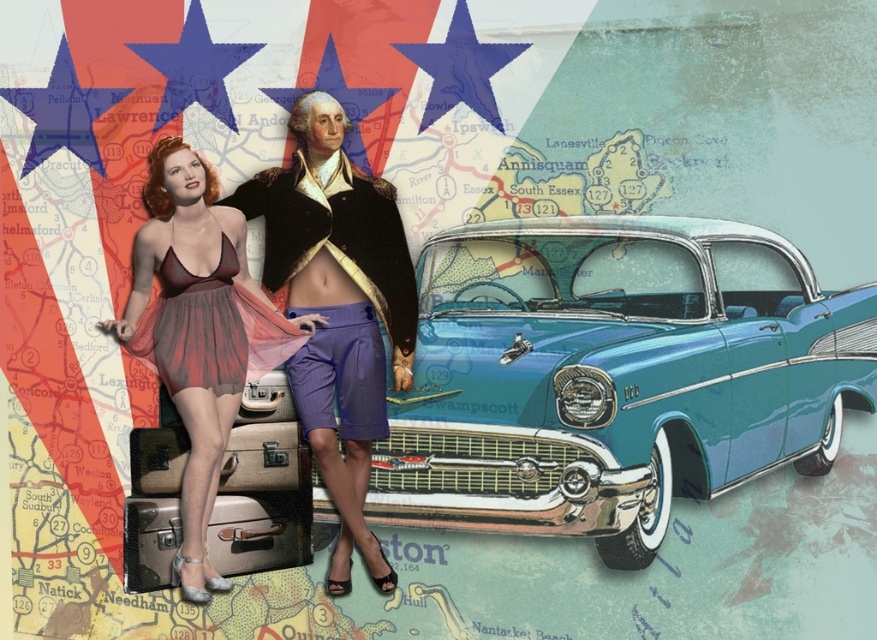
Is teal glossy car at center thinner than metallic suitcase at center?

No, teal glossy car at center is not thinner than metallic suitcase at center.

Can you confirm if teal glossy car at center is positioned below metallic suitcase at center?

No.

Between point (547, 352) and point (161, 480), which one is positioned behind?

Point (161, 480)

The width and height of the screenshot is (877, 640). What are the coordinates of `teal glossy car at center` in the screenshot? It's located at (612, 376).

Does matte red dress at center have a larger size compared to purple cotton shorts at center?

Correct, matte red dress at center is larger in size than purple cotton shorts at center.

Who is lower down, matte red dress at center or purple cotton shorts at center?

purple cotton shorts at center is lower down.

Between point (173, 198) and point (303, 433), which one is positioned in front?

Point (173, 198) is more forward.

Where is `matte red dress at center`? This screenshot has width=877, height=640. matte red dress at center is located at coordinates (198, 332).

Does teal glossy car at center appear on the right side of purple cotton shorts at center?

Yes, teal glossy car at center is to the right of purple cotton shorts at center.

Can you confirm if teal glossy car at center is shorter than purple cotton shorts at center?

Incorrect, teal glossy car at center's height does not fall short of purple cotton shorts at center's.

Measure the distance between point (640, 291) and camera.

They are 5.31 meters apart.

You are a GUI agent. You are given a task and a screenshot of the screen. Output one action in this format:
    pyautogui.click(x=<x>, y=<y>)
    Task: Click on the teal glossy car at center
    This screenshot has width=877, height=640.
    Given the screenshot: What is the action you would take?
    coord(612,376)